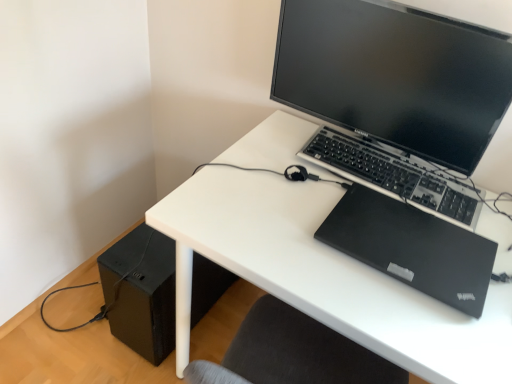
Locate an element on the screen. free space that is in between matte black monitor at upper center and black plastic keyboard at center is located at coordinates (285, 144).